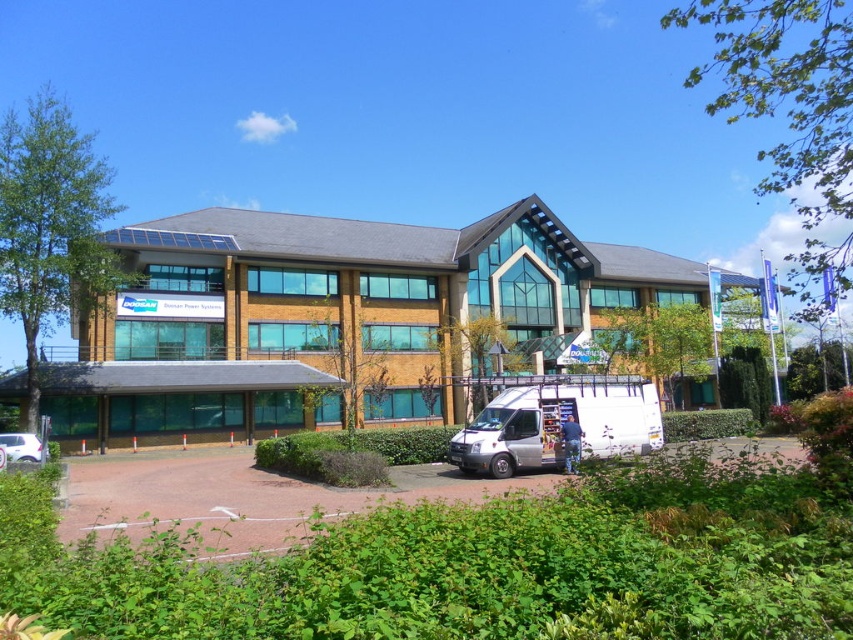
Question: Which point is farther to the camera?

Choices:
 (A) (544, 381)
 (B) (808, 502)
 (C) (454, 412)

Answer: (C)

Question: Does matte brown building at center have a smaller size compared to white matte van at lower center?

Choices:
 (A) no
 (B) yes

Answer: (A)

Question: Which point is farther to the camera?

Choices:
 (A) white matte van at lower center
 (B) matte brown building at center

Answer: (B)

Question: Is green leafy park at lower center positioned behind matte brown building at center?

Choices:
 (A) yes
 (B) no

Answer: (B)

Question: Observing the image, what is the correct spatial positioning of matte brown building at center in reference to white matte van at lower center?

Choices:
 (A) right
 (B) left

Answer: (A)

Question: Which point is closer to the camera taking this photo?

Choices:
 (A) (19, 445)
 (B) (490, 476)

Answer: (B)